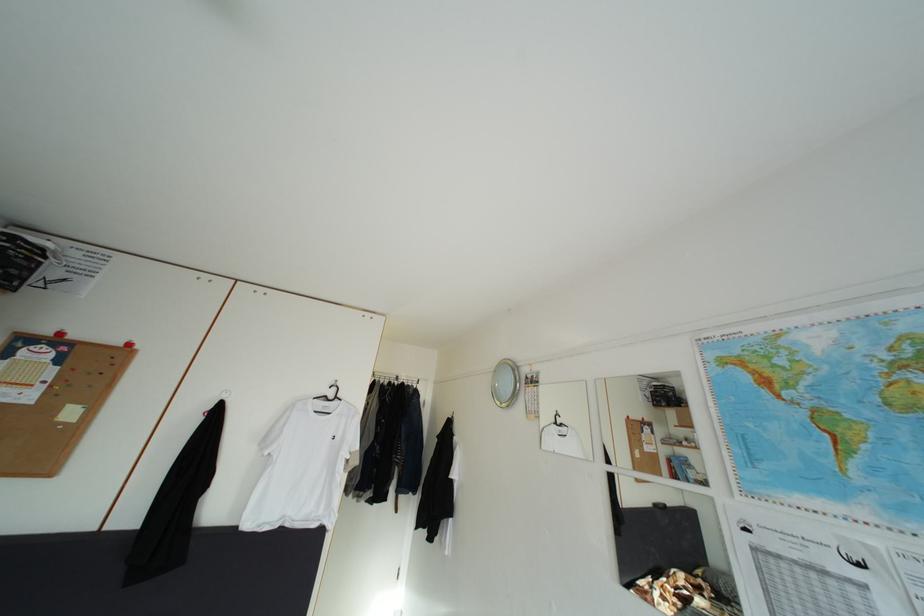
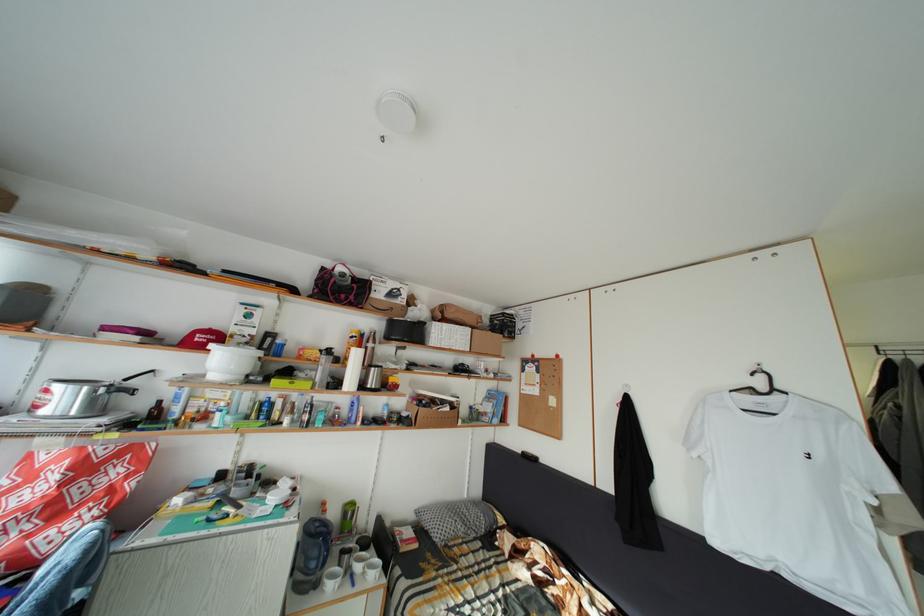
The images are taken continuously from a first-person perspective. In which direction is your viewpoint rotating?

The camera rotated toward left-up.